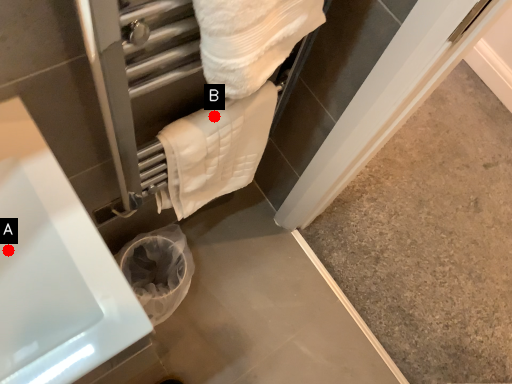
Question: Two points are circled on the image, labeled by A and B beside each circle. Which of the following is the farthest from the observer?

Choices:
 (A) A is further
 (B) B is further

Answer: (B)